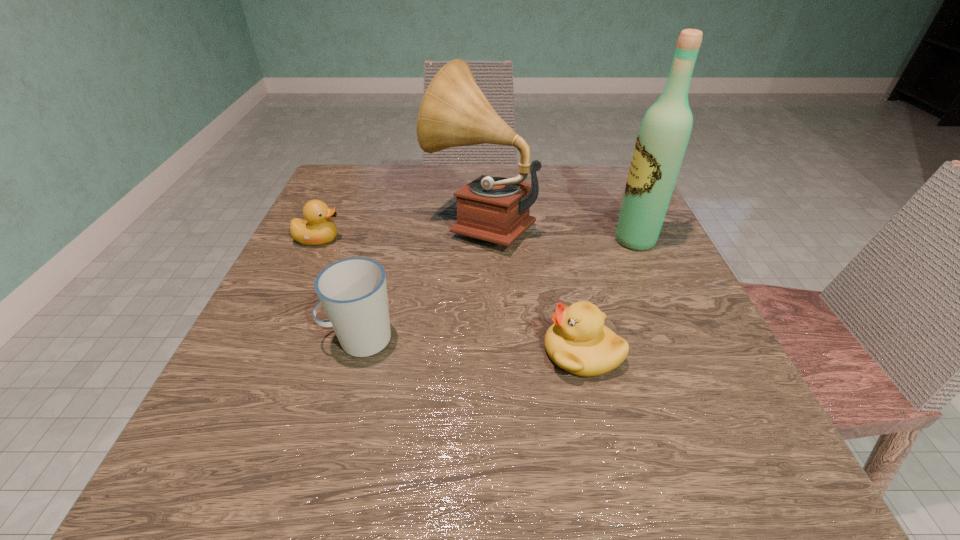
This screenshot has width=960, height=540. Find the location of `free space located 0.180m facing forward on the left duckling`. free space located 0.180m facing forward on the left duckling is located at coordinates (433, 239).

This screenshot has width=960, height=540. Identify the location of object at the far edge. (454, 112).

Locate an element on the screen. This screenshot has height=540, width=960. cup located in the left edge section of the desktop is located at coordinates (353, 292).

Where is `duckling positioned at the left edge`? The image size is (960, 540). duckling positioned at the left edge is located at coordinates (317, 229).

The image size is (960, 540). In order to click on wine bottle that is positioned at the right edge in this screenshot , I will do `click(665, 130)`.

Identify the location of duckling located at the right edge. The height and width of the screenshot is (540, 960). (578, 342).

Where is `vacant space at the far edge`? vacant space at the far edge is located at coordinates (547, 172).

I want to click on vacant space at the near edge, so click(x=582, y=464).

The width and height of the screenshot is (960, 540). In order to click on vacant region at the right edge of the desktop in this screenshot , I will do `click(672, 364)`.

The width and height of the screenshot is (960, 540). Find the location of `free region at the far right corner of the desktop`. free region at the far right corner of the desktop is located at coordinates (617, 184).